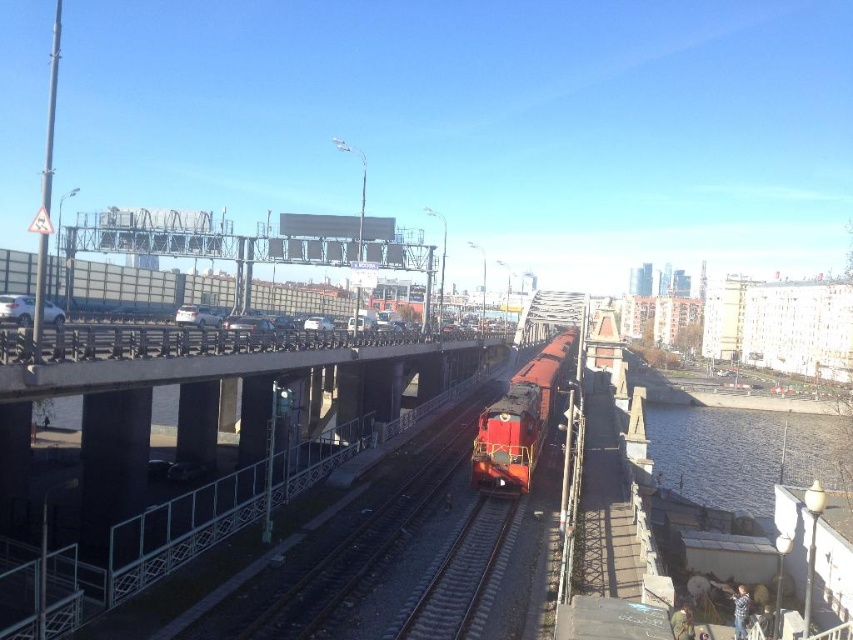
Does clear water at lower right appear on the left side of smooth steel tracks at center?

No, clear water at lower right is not to the left of smooth steel tracks at center.

Is clear water at lower right thinner than smooth steel tracks at center?

In fact, clear water at lower right might be wider than smooth steel tracks at center.

Between point (653, 428) and point (451, 612), which one is positioned behind?

Point (653, 428)

Image resolution: width=853 pixels, height=640 pixels. Identify the location of clear water at lower right. (744, 452).

Between metallic gray billboard at upper center and smooth steel tracks at center, which one has more height?

With more height is metallic gray billboard at upper center.

Is metallic gray billboard at upper center further to the viewer compared to smooth steel tracks at center?

Yes, it is.

The height and width of the screenshot is (640, 853). What do you see at coordinates (248, 240) in the screenshot?
I see `metallic gray billboard at upper center` at bounding box center [248, 240].

Where is `metallic gray billboard at upper center`? The width and height of the screenshot is (853, 640). metallic gray billboard at upper center is located at coordinates (248, 240).

Between point (703, 440) and point (521, 392), which one is positioned in front?

Point (521, 392) is in front.

Which is above, clear water at lower right or matte red train at center?

matte red train at center

Describe the element at coordinates (744, 452) in the screenshot. This screenshot has height=640, width=853. I see `clear water at lower right` at that location.

Find the location of a particular element. clear water at lower right is located at coordinates (744, 452).